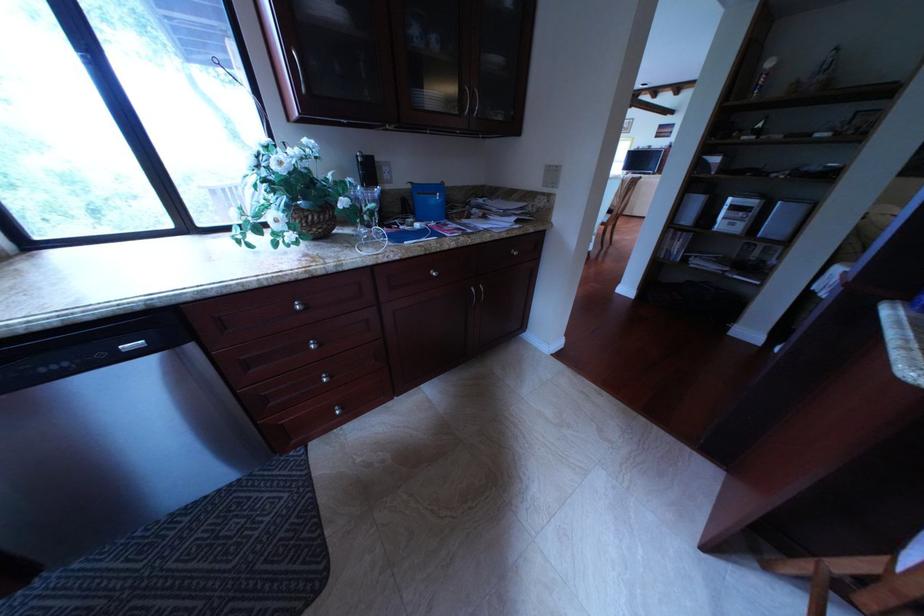
What do you see at coordinates (202, 557) in the screenshot? I see `a chair sitting surface` at bounding box center [202, 557].